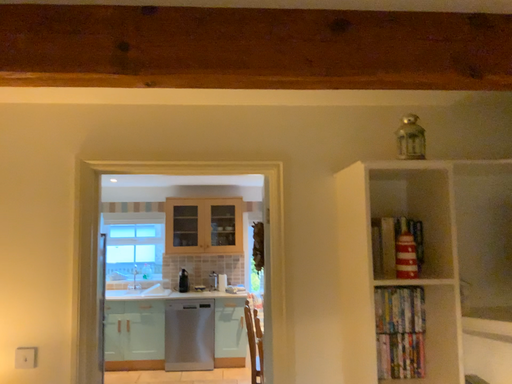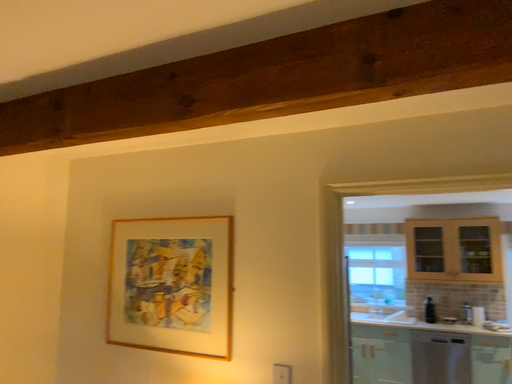
Question: Which way did the camera rotate in the video?

Choices:
 (A) rotated left
 (B) rotated right

Answer: (A)